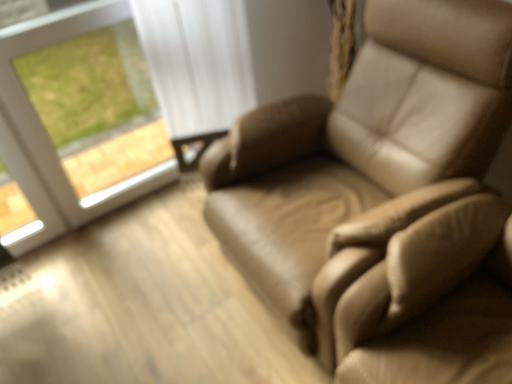
Question: From a real-world perspective, is leather chair at right on white glass window at upper left?

Choices:
 (A) no
 (B) yes

Answer: (A)

Question: Is leather chair at right located outside white glass window at upper left?

Choices:
 (A) yes
 (B) no

Answer: (A)

Question: Does leather chair at right have a greater width compared to white glass window at upper left?

Choices:
 (A) yes
 (B) no

Answer: (A)

Question: Is leather chair at right taller than white glass window at upper left?

Choices:
 (A) no
 (B) yes

Answer: (A)

Question: Considering the relative sizes of leather chair at right and white glass window at upper left in the image provided, is leather chair at right bigger than white glass window at upper left?

Choices:
 (A) no
 (B) yes

Answer: (B)

Question: From the image's perspective, is leather chair at right above white glass window at upper left?

Choices:
 (A) yes
 (B) no

Answer: (B)

Question: Considering the relative sizes of white glass window at upper left and leather chair at right in the image provided, is white glass window at upper left taller than leather chair at right?

Choices:
 (A) yes
 (B) no

Answer: (A)

Question: Is white glass window at upper left oriented away from leather chair at right?

Choices:
 (A) no
 (B) yes

Answer: (A)

Question: Does white glass window at upper left have a greater width compared to leather chair at right?

Choices:
 (A) yes
 (B) no

Answer: (B)

Question: Is white glass window at upper left to the right of leather chair at right from the viewer's perspective?

Choices:
 (A) yes
 (B) no

Answer: (B)

Question: Does white glass window at upper left turn towards leather chair at right?

Choices:
 (A) yes
 (B) no

Answer: (A)

Question: Is white glass window at upper left in contact with leather chair at right?

Choices:
 (A) yes
 (B) no

Answer: (B)

Question: Considering the positions of leather chair at right and white glass window at upper left in the image, is leather chair at right wider or thinner than white glass window at upper left?

Choices:
 (A) wide
 (B) thin

Answer: (A)